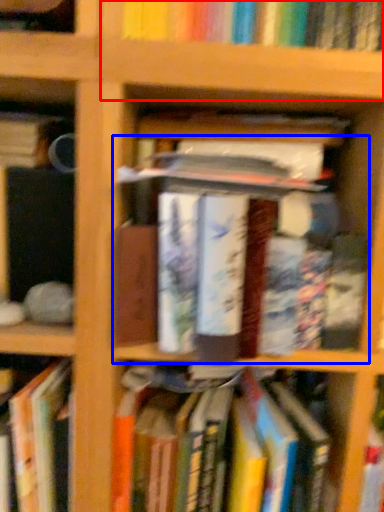
Question: Which object is further to the camera taking this photo, shelf (highlighted by a red box) or book (highlighted by a blue box)?

Choices:
 (A) shelf
 (B) book

Answer: (A)